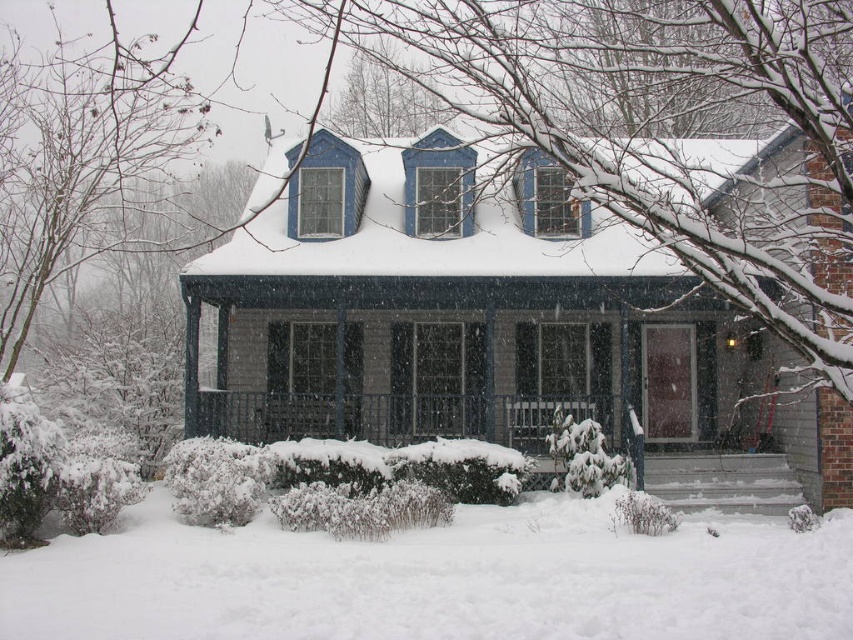
Question: Which object appears closest to the camera in this image?

Choices:
 (A) smooth gray porch at center
 (B) white fluffy snow at lower center

Answer: (B)

Question: Is white fluffy snow at lower center behind smooth gray porch at center?

Choices:
 (A) no
 (B) yes

Answer: (A)

Question: Among these objects, which one is farthest from the camera?

Choices:
 (A) white fluffy snow at lower center
 (B) smooth gray porch at center

Answer: (B)

Question: Among these objects, which one is nearest to the camera?

Choices:
 (A) white fluffy snow at lower center
 (B) smooth gray porch at center

Answer: (A)

Question: Is white fluffy snow at lower center smaller than smooth gray porch at center?

Choices:
 (A) yes
 (B) no

Answer: (A)

Question: Can you confirm if white fluffy snow at lower center is smaller than smooth gray porch at center?

Choices:
 (A) no
 (B) yes

Answer: (B)